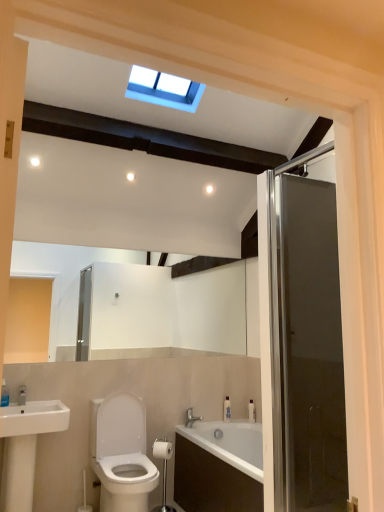
Question: From the image's perspective, is white plastic bottle at right, placed as the first toiletry when sorted from right to left, over white glossy toilet at lower left?

Choices:
 (A) no
 (B) yes

Answer: (B)

Question: Is white plastic bottle at right, placed as the first toiletry when sorted from right to left, placed right next to white glossy toilet at lower left?

Choices:
 (A) yes
 (B) no

Answer: (B)

Question: Is the position of white plastic bottle at right, placed as the first toiletry when sorted from right to left, more distant than that of white glossy toilet at lower left?

Choices:
 (A) no
 (B) yes

Answer: (B)

Question: Is the depth of white plastic bottle at right, placed as the first toiletry when sorted from right to left, less than that of white glossy toilet at lower left?

Choices:
 (A) no
 (B) yes

Answer: (A)

Question: Does white plastic bottle at right, placed as the first toiletry when sorted from right to left, have a larger size compared to white glossy toilet at lower left?

Choices:
 (A) yes
 (B) no

Answer: (B)

Question: Considering the positions of white plastic bottle at right, the 2th toiletry viewed from the left, and white glossy sink at lower left in the image, is white plastic bottle at right, the 2th toiletry viewed from the left, bigger or smaller than white glossy sink at lower left?

Choices:
 (A) big
 (B) small

Answer: (B)

Question: In terms of height, does white plastic bottle at right, placed as the first toiletry when sorted from right to left, look taller or shorter compared to white glossy sink at lower left?

Choices:
 (A) tall
 (B) short

Answer: (B)

Question: Is white plastic bottle at right, placed as the first toiletry when sorted from right to left, wider or thinner than white glossy sink at lower left?

Choices:
 (A) wide
 (B) thin

Answer: (B)

Question: Is point (253, 416) positioned closer to the camera than point (41, 418)?

Choices:
 (A) closer
 (B) farther

Answer: (B)

Question: From the image's perspective, is white glossy sink at lower left above or below white glossy toilet at lower left?

Choices:
 (A) below
 (B) above

Answer: (B)

Question: In the image, is white glossy sink at lower left positioned in front of or behind white glossy toilet at lower left?

Choices:
 (A) behind
 (B) front

Answer: (B)

Question: Is white glossy sink at lower left wider or thinner than white glossy toilet at lower left?

Choices:
 (A) thin
 (B) wide

Answer: (A)

Question: Is white glossy sink at lower left taller or shorter than white glossy toilet at lower left?

Choices:
 (A) short
 (B) tall

Answer: (B)

Question: Is white plastic bottle at right, placed as the first toiletry when sorted from right to left, taller or shorter than white glossy bottle at lower center, positioned as the first toiletry in left-to-right order?

Choices:
 (A) tall
 (B) short

Answer: (B)

Question: Visually, is white plastic bottle at right, the 2th toiletry viewed from the left, positioned to the left or to the right of white glossy bottle at lower center, acting as the 2th toiletry starting from the right?

Choices:
 (A) left
 (B) right

Answer: (B)